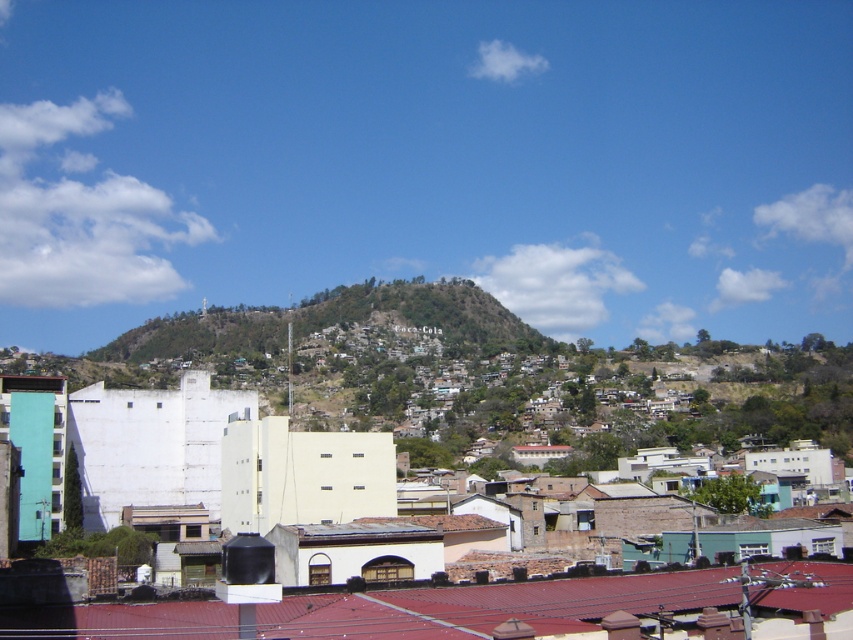
Question: Is white matte building at center bigger than green grassy hillside at center?

Choices:
 (A) no
 (B) yes

Answer: (A)

Question: Which of the following is the farthest from the observer?

Choices:
 (A) white matte building at center
 (B) green grassy hillside at center

Answer: (B)

Question: Which of the following is the closest to the observer?

Choices:
 (A) (x=163, y=620)
 (B) (x=561, y=348)

Answer: (A)

Question: Can you confirm if white matte building at center is thinner than green grassy hillside at center?

Choices:
 (A) yes
 (B) no

Answer: (A)

Question: Can you confirm if white matte building at center is positioned to the left of green grassy hillside at center?

Choices:
 (A) yes
 (B) no

Answer: (B)